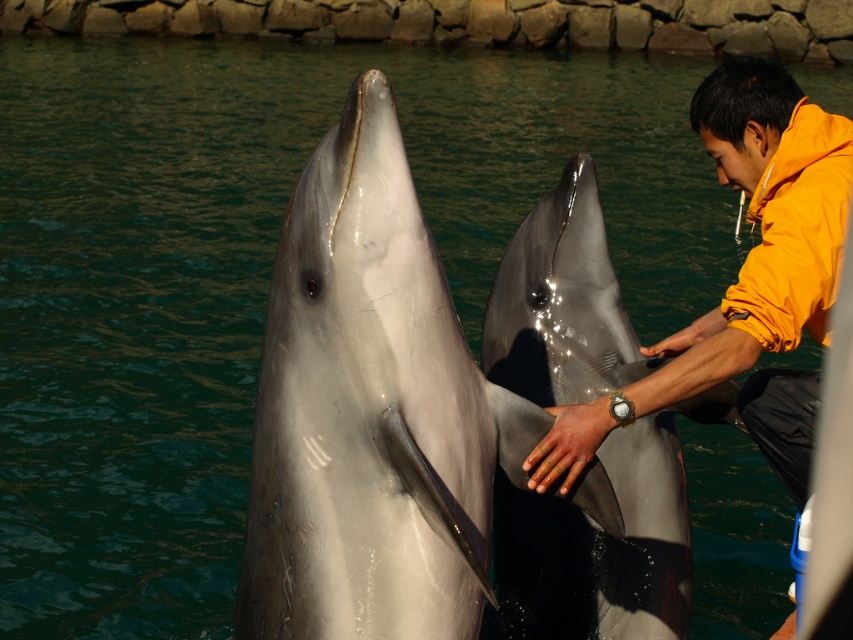
Question: Which is nearer to the glossy gray dolphin at center?

Choices:
 (A) yellow matte jacket at upper right
 (B) yellow fleece jacket at right

Answer: (A)

Question: Is glossy gray dolphin at center thinner than yellow matte jacket at upper right?

Choices:
 (A) yes
 (B) no

Answer: (A)

Question: Is white glossy dolphin at center positioned at the back of glossy gray dolphin at center?

Choices:
 (A) yes
 (B) no

Answer: (B)

Question: Considering the relative positions of glossy gray dolphin at center and yellow matte jacket at upper right in the image provided, where is glossy gray dolphin at center located with respect to yellow matte jacket at upper right?

Choices:
 (A) left
 (B) right

Answer: (A)

Question: Which point is closer to the camera?

Choices:
 (A) white glossy dolphin at center
 (B) yellow matte jacket at upper right
 (C) yellow fleece jacket at right
 (D) glossy gray dolphin at center

Answer: (A)

Question: Which point is farther from the camera taking this photo?

Choices:
 (A) (537, 204)
 (B) (268, 429)
 (C) (770, 324)
 (D) (735, 307)

Answer: (A)